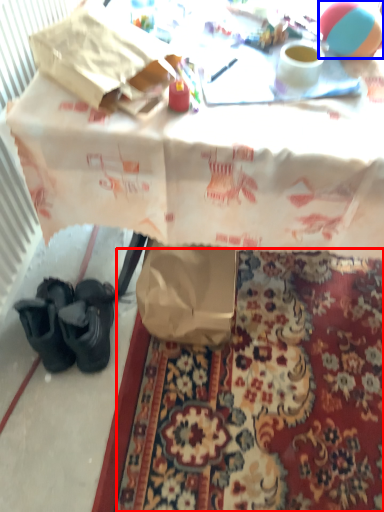
Question: Which point is closer to the camera, mat (highlighted by a red box) or ball (highlighted by a blue box)?

Choices:
 (A) mat
 (B) ball

Answer: (B)